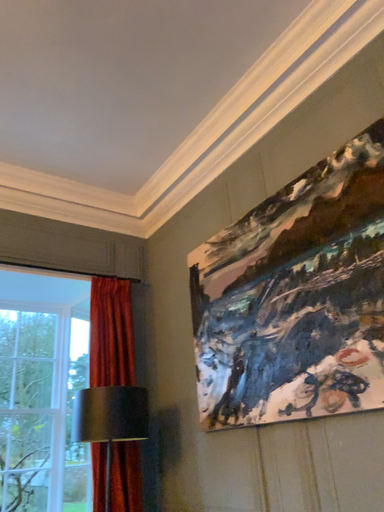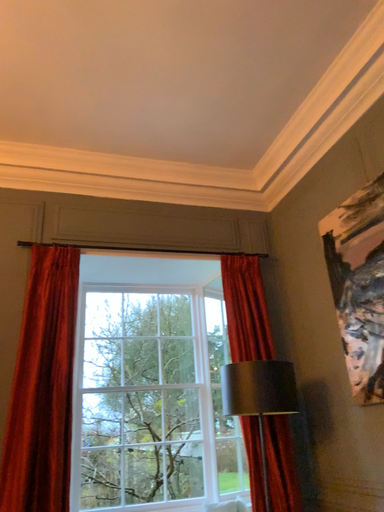
Question: Which way did the camera rotate in the video?

Choices:
 (A) rotated left
 (B) rotated right

Answer: (A)